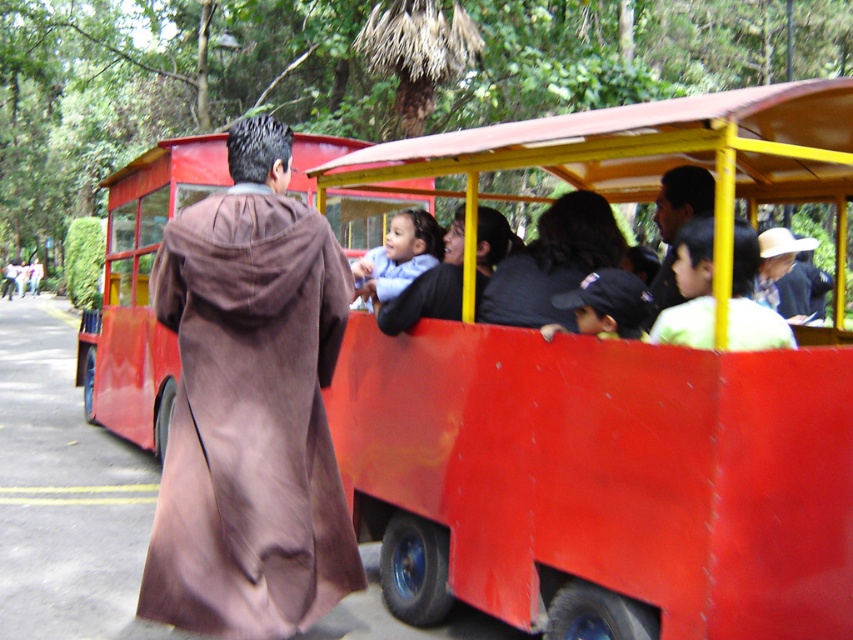
Question: Which object is positioned closest to the light blue fabric baby at center?

Choices:
 (A) matte black cap at center
 (B) smooth brown robe at upper right

Answer: (A)

Question: Observing the image, what is the correct spatial positioning of brown suede robe at left in reference to matte red bus at center?

Choices:
 (A) below
 (B) above

Answer: (A)

Question: Based on their relative distances, which object is nearer to the brown suede robe at left?

Choices:
 (A) smooth brown robe at upper right
 (B) matte black cap at center
 (C) dark brown fabric jacket at center

Answer: (C)

Question: Which object is the farthest from the matte red bus at center?

Choices:
 (A) smooth red bus at center
 (B) brown suede robe at left
 (C) matte black cap at center
 (D) dark brown fabric jacket at center

Answer: (C)

Question: Can you confirm if matte black cap at center is wider than smooth brown robe at upper right?

Choices:
 (A) no
 (B) yes

Answer: (B)

Question: Is matte red bus at center to the right of light blue fabric baby at center from the viewer's perspective?

Choices:
 (A) yes
 (B) no

Answer: (B)